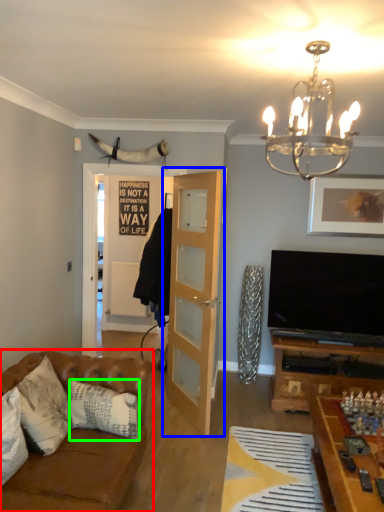
Question: Which object is positioned farthest from studio couch (highlighted by a red box)? Select from door (highlighted by a blue box) and pillow (highlighted by a green box).

Choices:
 (A) door
 (B) pillow

Answer: (A)